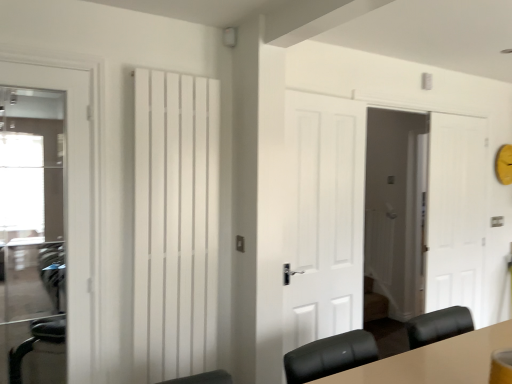
Question: Does white matte door at center, which is counted as the 2th door, starting from the back, have a larger size compared to white glossy door at left, which is counted as the fourth door, starting from the right?

Choices:
 (A) no
 (B) yes

Answer: (B)

Question: Is white matte door at center, which ranks as the second door in right-to-left order, at the left side of white glossy door at left, marked as the first door in a left-to-right arrangement?

Choices:
 (A) yes
 (B) no

Answer: (B)

Question: From the image's perspective, is white matte door at center, which ranks as the second door in right-to-left order, above white glossy door at left, which is counted as the fourth door, starting from the right?

Choices:
 (A) no
 (B) yes

Answer: (A)

Question: Does white matte door at center, which is counted as the 3th door, starting from the front, have a lesser width compared to white glossy door at left, the 4th door from the back?

Choices:
 (A) yes
 (B) no

Answer: (B)

Question: Is white glossy door at left, marked as the first door in a left-to-right arrangement, located within white matte door at center, which is counted as the 3th door, starting from the front?

Choices:
 (A) no
 (B) yes

Answer: (A)

Question: Is white matte door at center, which is counted as the 3th door, starting from the front, smaller than white glossy door at left, the 4th door from the back?

Choices:
 (A) yes
 (B) no

Answer: (B)

Question: Does white glossy door at left, the 4th door from the back, appear on the right side of white matte door at right, the 1th door viewed from the right?

Choices:
 (A) yes
 (B) no

Answer: (B)

Question: Can you confirm if white glossy door at left, the 4th door from the back, is shorter than white matte door at right, positioned as the 1th door in back-to-front order?

Choices:
 (A) no
 (B) yes

Answer: (B)

Question: Can you confirm if white glossy door at left, which ranks as the first door in front-to-back order, is positioned to the left of white matte door at right, placed as the 4th door when sorted from front to back?

Choices:
 (A) yes
 (B) no

Answer: (A)

Question: Is white glossy door at left, the 4th door from the back, further to camera compared to white matte door at right, placed as the 4th door when sorted from front to back?

Choices:
 (A) no
 (B) yes

Answer: (A)

Question: Is white glossy door at left, which is counted as the fourth door, starting from the right, smaller than white matte door at right, the 1th door viewed from the right?

Choices:
 (A) yes
 (B) no

Answer: (A)

Question: Can white matte door at right, the 1th door viewed from the right, be found inside white glossy door at left, the 4th door from the back?

Choices:
 (A) no
 (B) yes

Answer: (A)

Question: Is white matte radiator at center surrounding white matte door at center, which is counted as the 3th door, starting from the front?

Choices:
 (A) yes
 (B) no

Answer: (B)